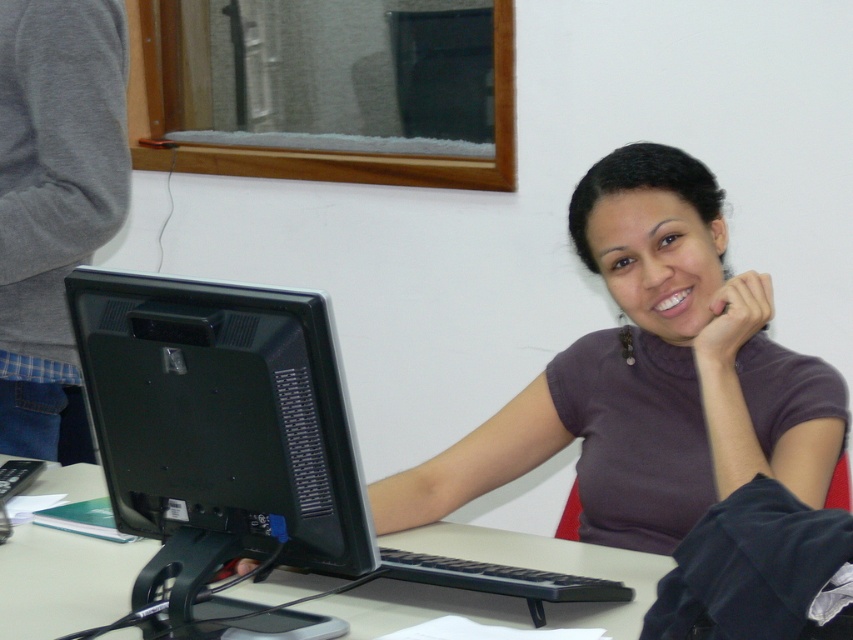
Question: Which object is the farthest from the black plastic monitor at center?

Choices:
 (A) matte purple shirt at center
 (B) white plastic computer desk at center

Answer: (A)

Question: Which point is farther to the camera?

Choices:
 (A) (683, 499)
 (B) (7, 618)

Answer: (A)

Question: Can you confirm if black plastic monitor at center is positioned below white plastic computer desk at center?

Choices:
 (A) yes
 (B) no

Answer: (B)

Question: Which point is farther from the camera taking this photo?

Choices:
 (A) (88, 477)
 (B) (706, 401)
 (C) (155, 340)

Answer: (A)

Question: Is matte purple shirt at center above white plastic computer desk at center?

Choices:
 (A) yes
 (B) no

Answer: (A)

Question: Is matte purple shirt at center bigger than black plastic monitor at center?

Choices:
 (A) no
 (B) yes

Answer: (B)